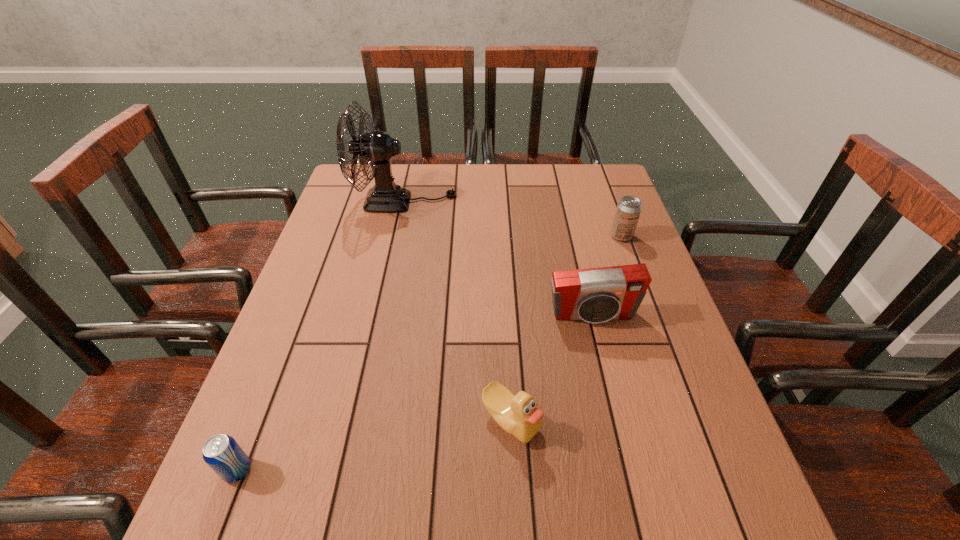
Locate an element on the screen. the fourth object from right to left is located at coordinates (377, 148).

The image size is (960, 540). Find the location of `the farthest object`. the farthest object is located at coordinates (377, 148).

At what (x,y) coordinates should I click in order to perform the action: click on camera. Please return your answer as a coordinate pair (x, y). The height and width of the screenshot is (540, 960). Looking at the image, I should click on (596, 295).

Locate an element on the screen. The width and height of the screenshot is (960, 540). the second object from right to left is located at coordinates (596, 295).

You are a GUI agent. You are given a task and a screenshot of the screen. Output one action in this format:
    pyautogui.click(x=<x>, y=<y>)
    Task: Click on the fourth nearest object
    The width and height of the screenshot is (960, 540).
    Given the screenshot: What is the action you would take?
    pyautogui.click(x=628, y=210)

Where is `the right beer can`? The width and height of the screenshot is (960, 540). the right beer can is located at coordinates [x=628, y=210].

At what (x,y) coordinates should I click in order to perform the action: click on duck. Please return your answer as a coordinate pair (x, y). The height and width of the screenshot is (540, 960). Looking at the image, I should click on [x=519, y=415].

I want to click on the fourth farthest object, so click(x=519, y=415).

Image resolution: width=960 pixels, height=540 pixels. What are the coordinates of `the shorter beer can` in the screenshot? It's located at (222, 453).

Where is `the nearest object`? The image size is (960, 540). the nearest object is located at coordinates (222, 453).